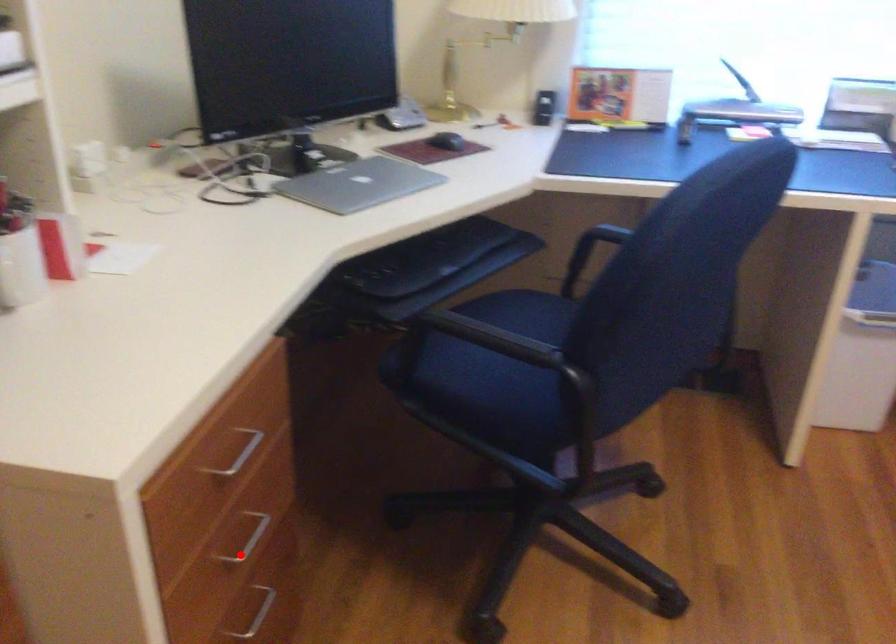
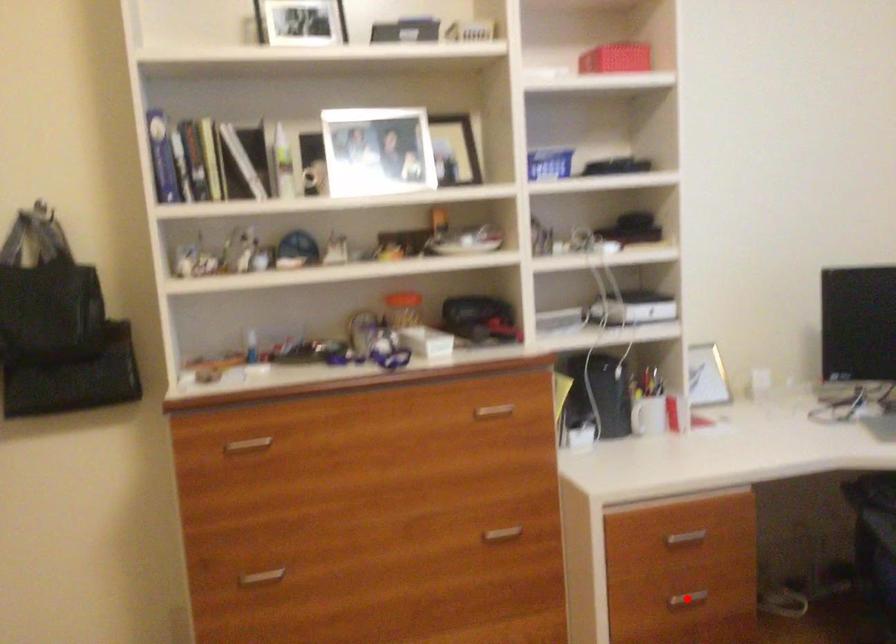
I am providing you with two images of the same scene from different viewpoints. A red point is marked on the first image and another point is marked on the second image. Do the highlighted points in image1 and image2 indicate the same real-world spot?

Yes